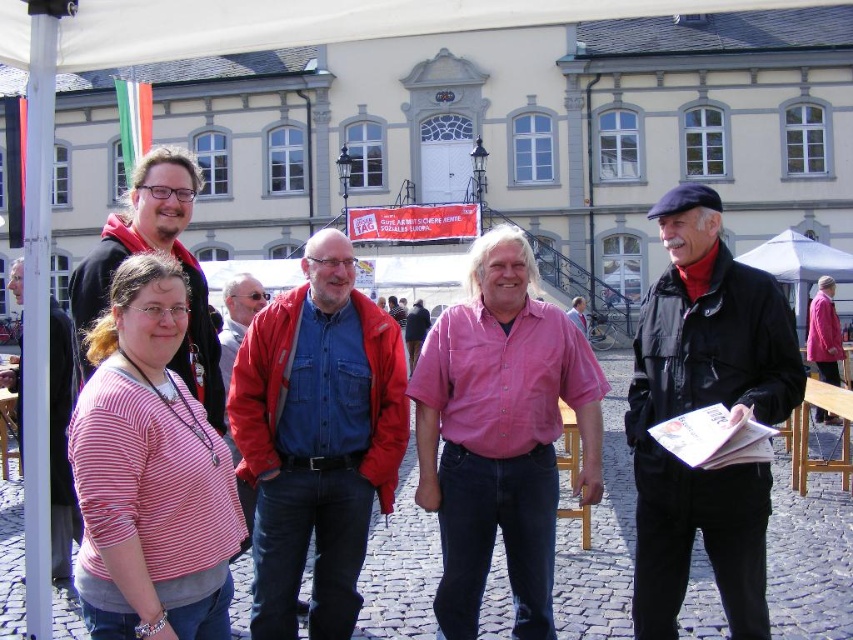
You are standing at the center of the image and want to hand a document to both the person wearing the red denim jacket at center and the person wearing the matte black jacket at left. Which jacket is closer to you?

The red denim jacket at center is closer to you since you are standing at the center of the image, and it is only 16.56 feet away from the matte black jacket at left. However, since you are at the center, the red denim jacket at center is right where you are standing, making it the closest.

You are standing in front of the historic building and want to take a photo of the red denim jacket at center and the matte black jacket at left. Which jacket is closer to the camera?

The red denim jacket at center is positioned under the matte black jacket at left, so the matte black jacket at left is closer to the camera.

You are standing in front of the historic building and notice the pink cotton shirt at center. Can you determine its exact position using the coordinate system provided?

The pink cotton shirt at center is located at point (502, 435) according to the coordinate system provided.